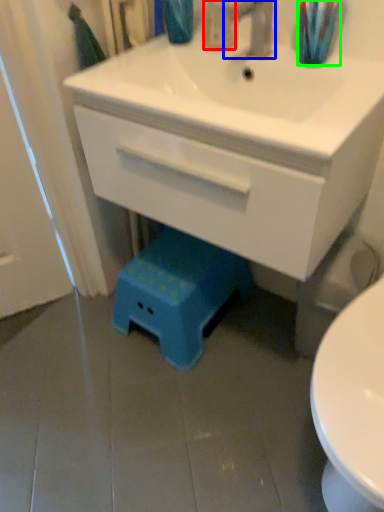
Question: Considering the real-world distances, which object is farthest from toiletry (highlighted by a red box)? tap (highlighted by a blue box) or toothbrush (highlighted by a green box)?

Choices:
 (A) tap
 (B) toothbrush

Answer: (B)